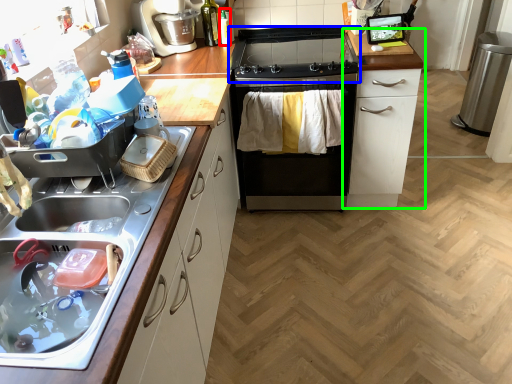
Question: Which object is positioned farthest from bottle (highlighted by a red box)? Select from gas stove (highlighted by a blue box) and cabinetry (highlighted by a green box).

Choices:
 (A) gas stove
 (B) cabinetry

Answer: (B)